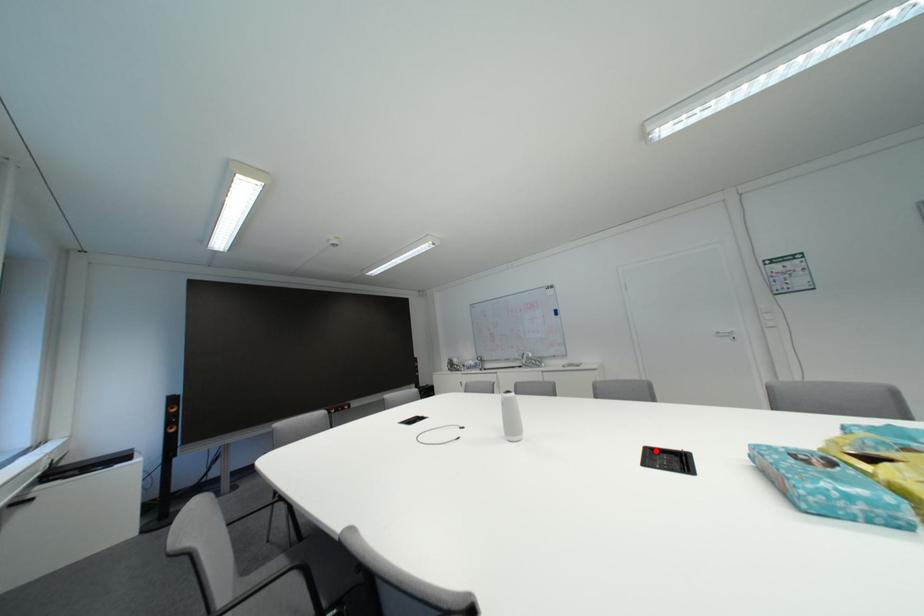
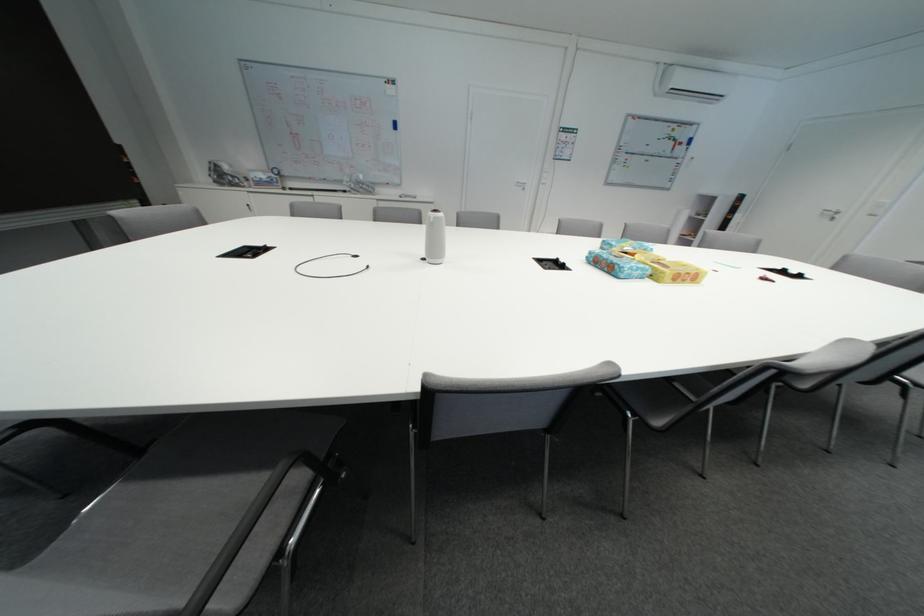
In the second image, find the point that corresponds to the highlighted location in the first image.

(544, 262)